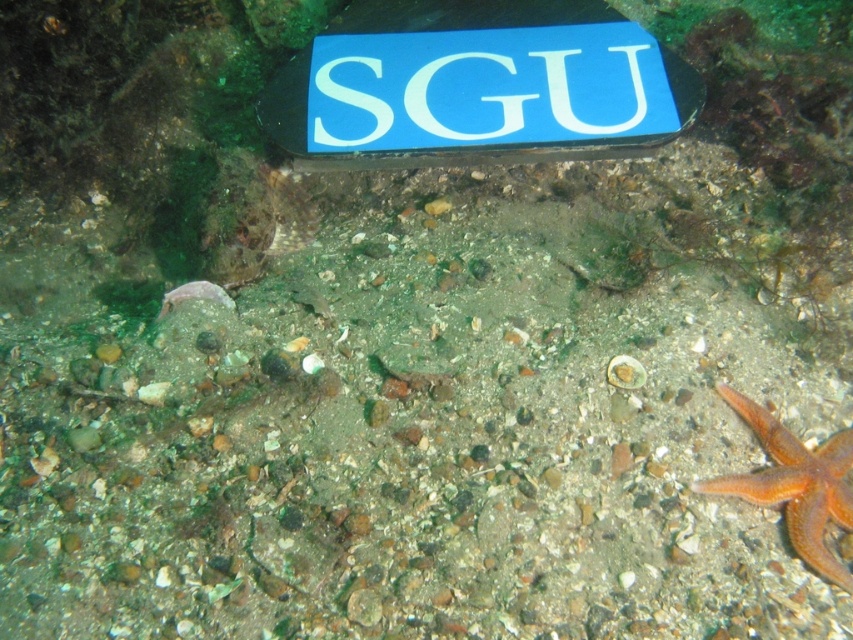
Does blue plastic sign at upper center appear under orange matte starfish at lower right?

Actually, blue plastic sign at upper center is above orange matte starfish at lower right.

Describe the element at coordinates (477, 84) in the screenshot. I see `blue plastic sign at upper center` at that location.

This screenshot has width=853, height=640. Identify the location of blue plastic sign at upper center. (477, 84).